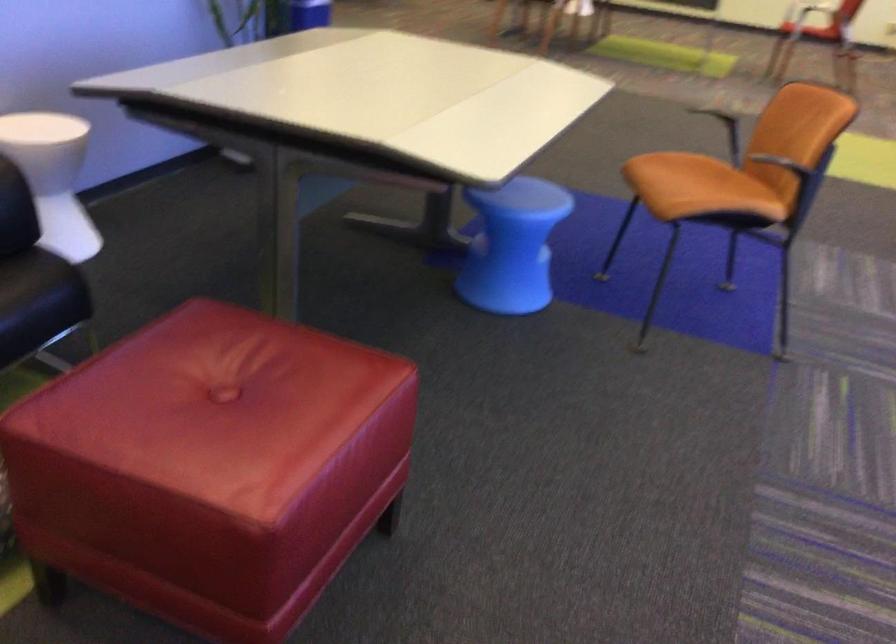
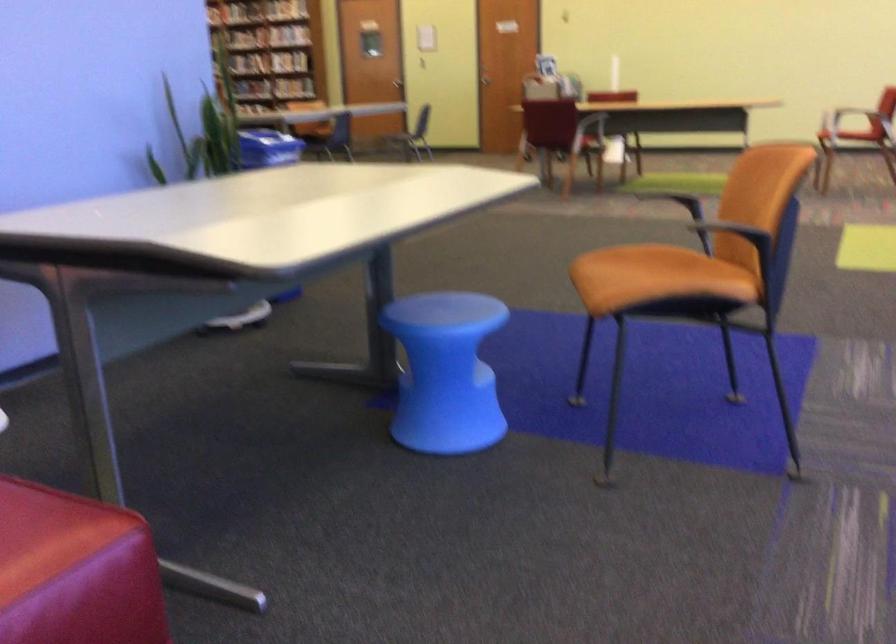
Where in the second image is the point corresponding to point 521,247 from the first image?

(445, 372)